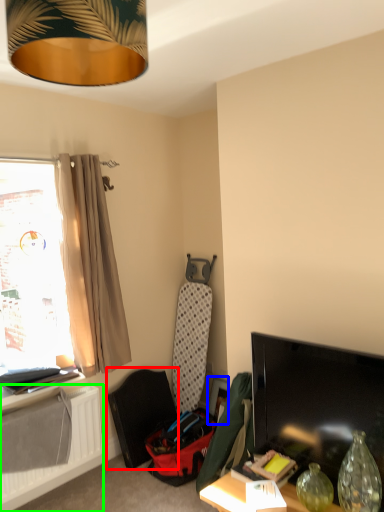
Question: Based on their relative distances, which object is farther from swivel chair (highlighted by a red box)? Choose from picture frame (highlighted by a blue box) and radiator (highlighted by a green box).

Choices:
 (A) picture frame
 (B) radiator

Answer: (A)